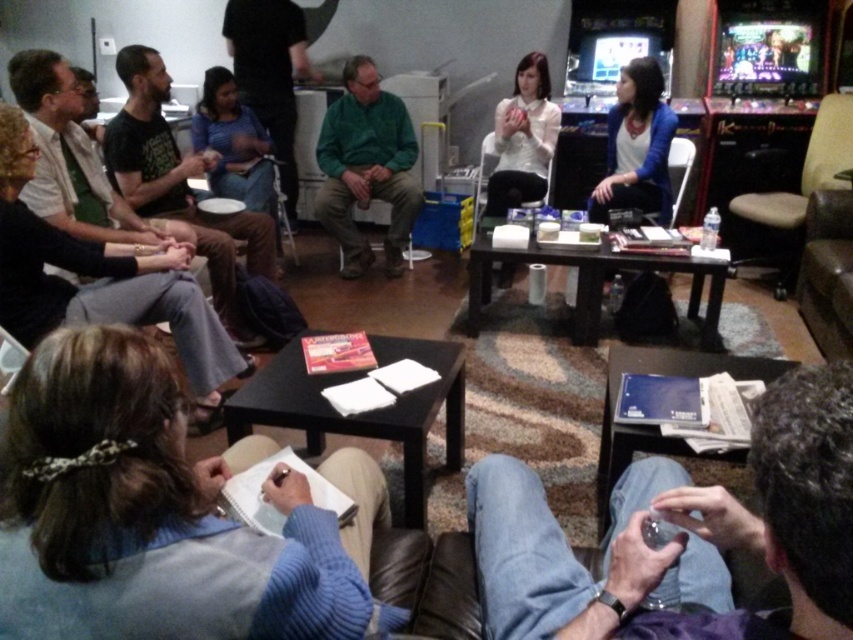
In the scene shown: You are a photographer standing at the entrance of the room. You want to take a photo that includes both the green matte jacket at center and the dark blue shirt at upper center. The camera you are using has a maximum focus range of 30 inches. Can you capture both subjects in focus without moving the camera or the subjects?

The green matte jacket at center is 31.24 inches away from the dark blue shirt at upper center. Since the distance exceeds the camera maximum focus range of 30 inches, you cannot capture both subjects in focus without adjusting the camera or moving the subjects.